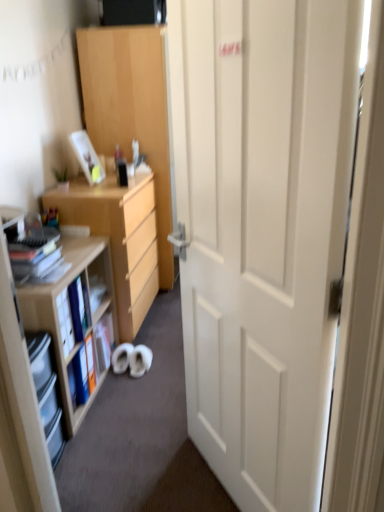
I want to click on vacant space in matte plastic picture frame at upper left (from a real-world perspective), so click(85, 183).